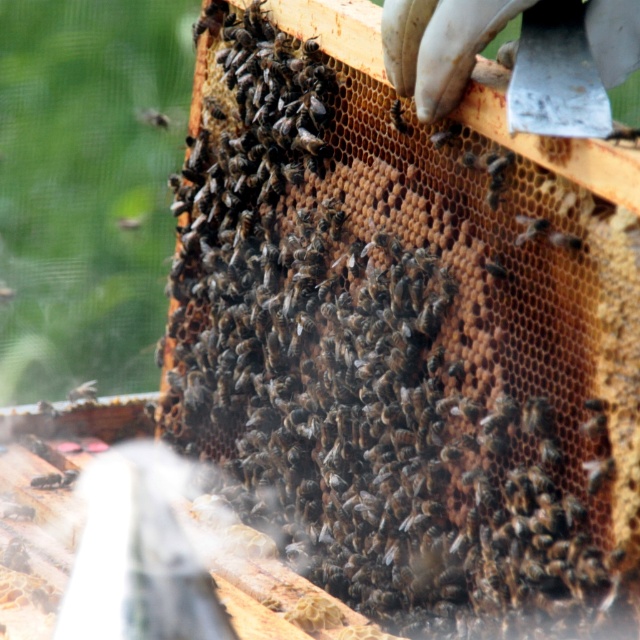
Question: Among these points, which one is farthest from the camera?

Choices:
 (A) (45, 404)
 (B) (83, 394)

Answer: (B)

Question: Can you confirm if black fuzzy bee at center is bigger than black fuzzy bee at lower left?

Choices:
 (A) yes
 (B) no

Answer: (A)

Question: Can you confirm if black fuzzy bee at center is smaller than black fuzzy bee at lower left?

Choices:
 (A) yes
 (B) no

Answer: (B)

Question: Does black fuzzy bee at center have a greater width compared to black fuzzy bee at lower left?

Choices:
 (A) no
 (B) yes

Answer: (B)

Question: Among these points, which one is farthest from the camera?

Choices:
 (A) (51, 408)
 (B) (90, 392)

Answer: (B)